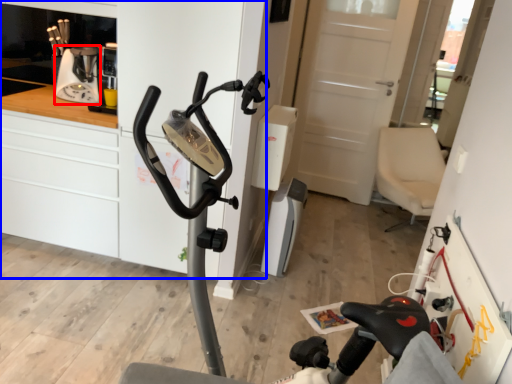
Question: Which of the following is the closest to the observer, coffee machine (highlighted by a red box) or dresser (highlighted by a blue box)?

Choices:
 (A) coffee machine
 (B) dresser

Answer: (B)